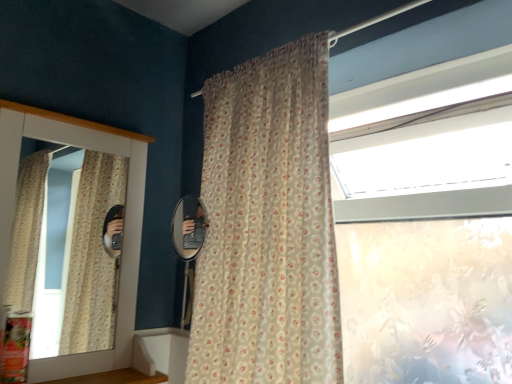
Question: Is matte white medicine cabinet at left touching translucent floral-patterned curtain at center?

Choices:
 (A) no
 (B) yes

Answer: (A)

Question: Is translucent floral-patterned curtain at center a part of matte white medicine cabinet at left?

Choices:
 (A) yes
 (B) no

Answer: (B)

Question: Is matte white medicine cabinet at left not within translucent floral-patterned curtain at center?

Choices:
 (A) no
 (B) yes

Answer: (B)

Question: Could you tell me if matte white medicine cabinet at left is turned towards translucent floral-patterned curtain at center?

Choices:
 (A) yes
 (B) no

Answer: (A)

Question: From the image's perspective, is matte white medicine cabinet at left over translucent floral-patterned curtain at center?

Choices:
 (A) yes
 (B) no

Answer: (B)

Question: From the image's perspective, relative to wooden at lower left, is matte white medicine cabinet at left above or below?

Choices:
 (A) below
 (B) above

Answer: (B)

Question: In the image, is matte white medicine cabinet at left positioned in front of or behind wooden at lower left?

Choices:
 (A) front
 (B) behind

Answer: (B)

Question: Is matte white medicine cabinet at left inside the boundaries of wooden at lower left, or outside?

Choices:
 (A) inside
 (B) outside

Answer: (B)

Question: Based on their positions, is matte white medicine cabinet at left located to the left or right of wooden at lower left?

Choices:
 (A) right
 (B) left

Answer: (A)

Question: From the image's perspective, is wooden at lower left located above or below translucent floral-patterned curtain at center?

Choices:
 (A) below
 (B) above

Answer: (A)

Question: Choose the correct answer: Is wooden at lower left inside translucent floral-patterned curtain at center or outside it?

Choices:
 (A) outside
 (B) inside

Answer: (A)

Question: In the image, is wooden at lower left positioned in front of or behind translucent floral-patterned curtain at center?

Choices:
 (A) behind
 (B) front

Answer: (A)

Question: In terms of height, does wooden at lower left look taller or shorter compared to translucent floral-patterned curtain at center?

Choices:
 (A) tall
 (B) short

Answer: (B)

Question: Considering the positions of translucent floral-patterned curtain at center and matte white medicine cabinet at left in the image, is translucent floral-patterned curtain at center taller or shorter than matte white medicine cabinet at left?

Choices:
 (A) short
 (B) tall

Answer: (B)

Question: From the image's perspective, is translucent floral-patterned curtain at center above or below matte white medicine cabinet at left?

Choices:
 (A) above
 (B) below

Answer: (A)